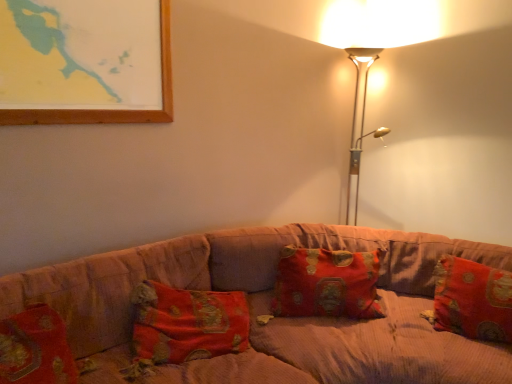
Question: Considering the relative sizes of red brocade pillow at right, which ranks as the 1th pillow in right-to-left order, and corduroy fabric couch at center in the image provided, is red brocade pillow at right, which ranks as the 1th pillow in right-to-left order, taller than corduroy fabric couch at center?

Choices:
 (A) no
 (B) yes

Answer: (A)

Question: Is red brocade pillow at right, the 2th pillow positioned from the left, not inside corduroy fabric couch at center?

Choices:
 (A) yes
 (B) no

Answer: (B)

Question: Can you confirm if red brocade pillow at right, the 2th pillow positioned from the left, is positioned to the right of corduroy fabric couch at center?

Choices:
 (A) yes
 (B) no

Answer: (A)

Question: Is red brocade pillow at right, the 2th pillow positioned from the left, not near corduroy fabric couch at center?

Choices:
 (A) no
 (B) yes

Answer: (A)

Question: From a real-world perspective, is red brocade pillow at right, the 2th pillow positioned from the left, below corduroy fabric couch at center?

Choices:
 (A) no
 (B) yes

Answer: (A)

Question: Does red brocade pillow at right, the 2th pillow positioned from the left, have a greater width compared to corduroy fabric couch at center?

Choices:
 (A) no
 (B) yes

Answer: (A)

Question: Can you confirm if corduroy fabric couch at center is positioned to the right of red brocade pillow at center, acting as the second pillow starting from the right?

Choices:
 (A) yes
 (B) no

Answer: (B)

Question: Is corduroy fabric couch at center positioned with its back to red brocade pillow at center, acting as the second pillow starting from the right?

Choices:
 (A) yes
 (B) no

Answer: (A)

Question: Is corduroy fabric couch at center oriented towards red brocade pillow at center, which appears as the 1th pillow when viewed from the left?

Choices:
 (A) no
 (B) yes

Answer: (B)

Question: Can you confirm if corduroy fabric couch at center is positioned to the left of red brocade pillow at center, acting as the second pillow starting from the right?

Choices:
 (A) yes
 (B) no

Answer: (A)

Question: Is corduroy fabric couch at center in front of red brocade pillow at center, acting as the second pillow starting from the right?

Choices:
 (A) no
 (B) yes

Answer: (B)

Question: Are corduroy fabric couch at center and red brocade pillow at center, acting as the second pillow starting from the right, beside each other?

Choices:
 (A) yes
 (B) no

Answer: (B)

Question: Is metallic gold floor lamp at upper right outside of red brocade pillow at right, the 2th pillow positioned from the left?

Choices:
 (A) yes
 (B) no

Answer: (A)